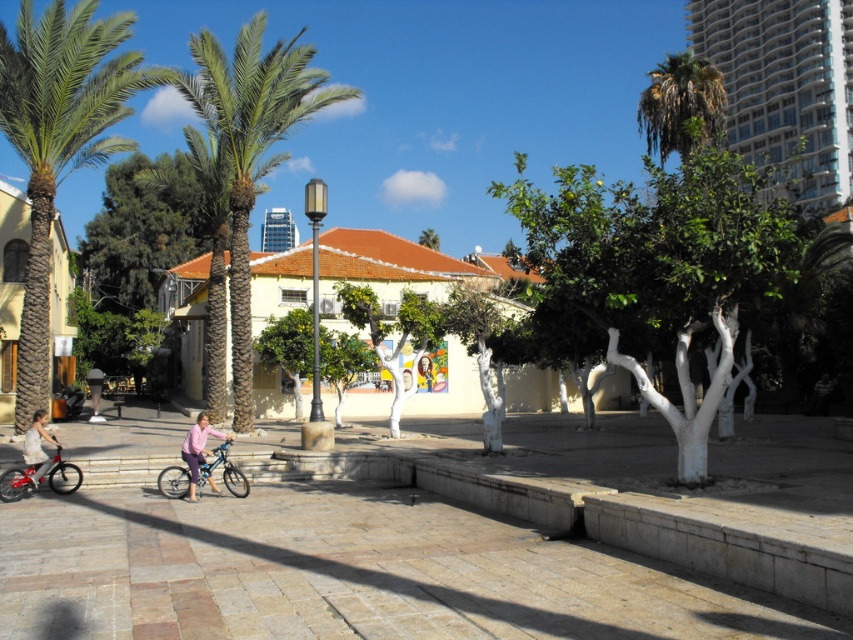
Question: From the image, what is the correct spatial relationship of green leafy palm tree at left in relation to metallic blue bicycle at lower left?

Choices:
 (A) right
 (B) left

Answer: (B)

Question: Is green leafy tree at center below metallic silver bicycle at lower left?

Choices:
 (A) yes
 (B) no

Answer: (B)

Question: Which point is farther to the camera?

Choices:
 (A) (637, 323)
 (B) (155, 618)
 (C) (26, 440)

Answer: (A)

Question: Considering the real-world distances, which object is farthest from the metallic blue bicycle at lower left?

Choices:
 (A) pink fabric shirt at center
 (B) brick pavement at center

Answer: (B)

Question: Which of the following is the closest to the observer?

Choices:
 (A) (231, 493)
 (B) (682, 115)
 (C) (590, 220)

Answer: (C)

Question: Does brick pavement at center appear under metallic blue bicycle at lower left?

Choices:
 (A) yes
 (B) no

Answer: (A)